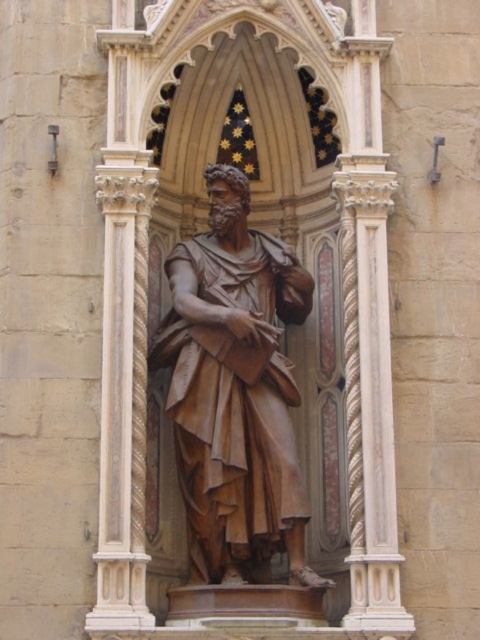
You are an interior designer planning to place a new sofa in a living room. The room has the brown polished wood statue at center and the white marble column at center. You need to ensure the sofa can fit between them. What should you consider about their widths?

The brown polished wood statue at center is wider than the white marble column at center. Therefore, the sofa must be narrower than the narrower of the two, which is the white marble column at center, to fit between them.

You are an art conservator standing at the entrance of the niche. You need to move the brown polished wood statue at center and the white marble column at center closer to each other by 5 feet. Is this possible given their current positions?

The brown polished wood statue at center is currently 13.39 feet away from the white marble column at center. Moving them closer by 5 feet would require reducing the distance to 8.39 feet. Since there are no obstacles mentioned in the scene, this adjustment is feasible.

Consider the image. You are an art conservator examining the statue from the front. You notice two points on the statue marked at coordinates point (227, 305) and point (348, 308). Which of these points is closer to your current viewpoint?

Point (227, 305) is closer to the viewer than point (348, 308).